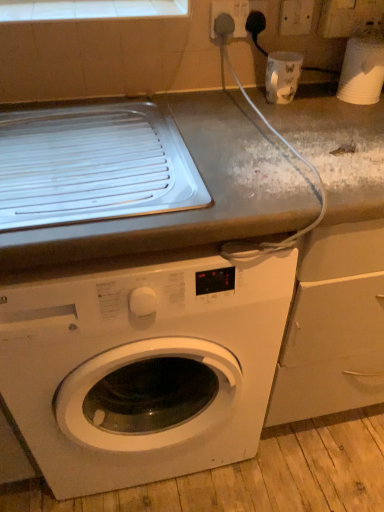
Locate an element on the screen. The image size is (384, 512). vacant space to the right of white glossy cup at upper right, acting as the first appliance starting from the left is located at coordinates (329, 104).